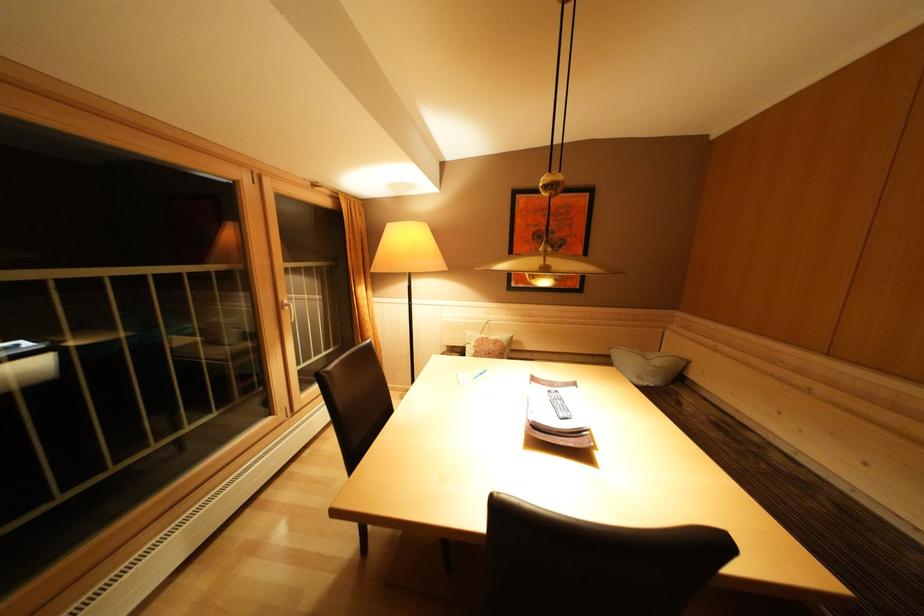
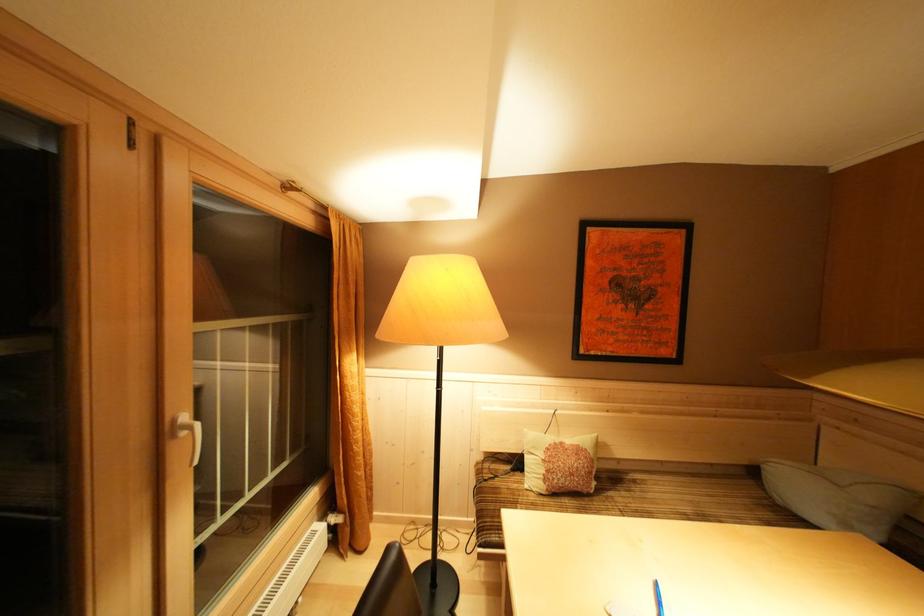
In the second image, find the point that corresponds to (x=493, y=342) in the first image.

(568, 448)